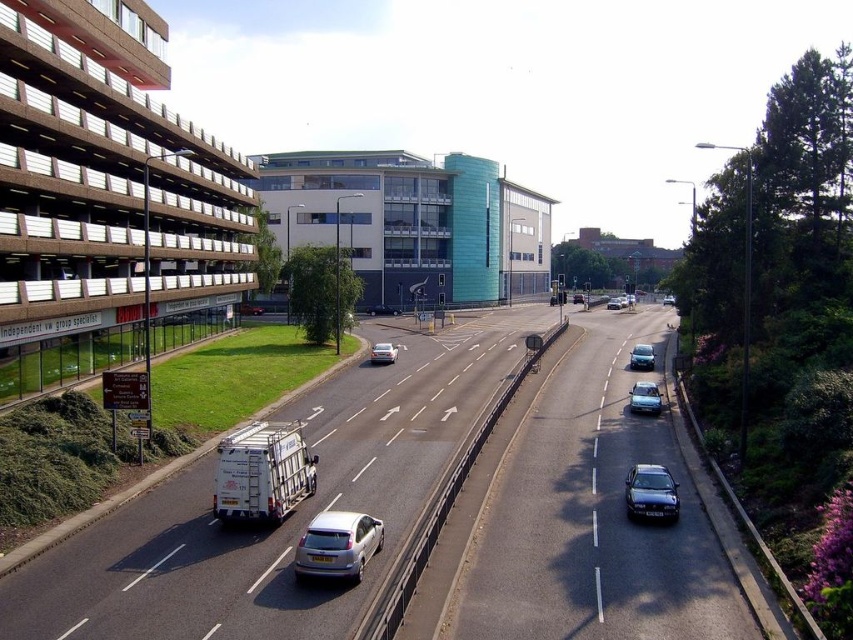
You are a delivery driver who needs to park your vehicle in a parking space that is 1.8 meters wide. You observe a silver metallic hatchback at center and a satin silver sedan at center. Which vehicle would fit better in the parking space?

The silver metallic hatchback at center has a lesser width compared to the satin silver sedan at center, so it would fit better in the 1.8 meters wide parking space.

You are a delivery driver who needs to park your shiny black sedan at center in the parking structure on the left. The parking spot you want is located at point coordinates of 0.800, 0.750. Will your vehicle fit into the desired parking spot?

The shiny black sedan at center is positioned at point (651, 492), which is very close to the desired parking spot at (639, 512). However, the exact dimensions of the parking spot and the vehicle are not provided, so it is uncertain if the vehicle will fit. Please check the parking spot size before proceeding.